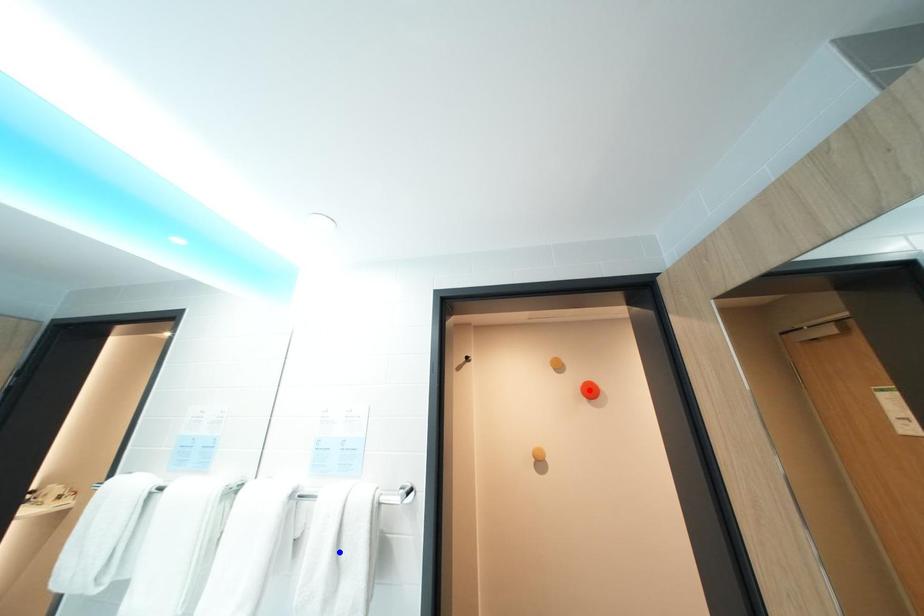
Question: Two points are marked on the image. Which point is closer to the camera?

Choices:
 (A) Blue point is closer.
 (B) Red point is closer.

Answer: (A)